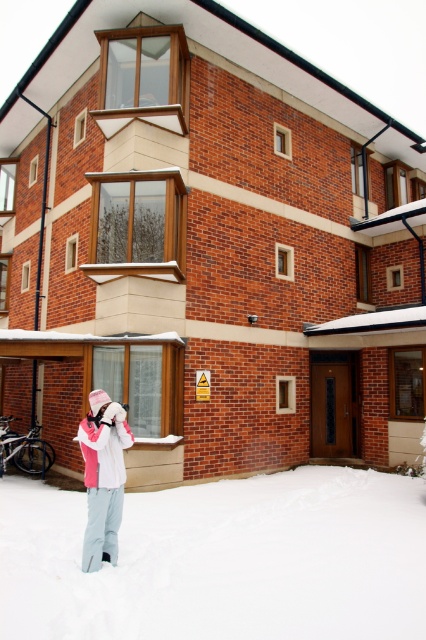
Does point (3, 625) lie in front of point (86, 470)?

Yes, it is in front of point (86, 470).

Who is positioned more to the left, white fluffy snow at lower center or white fleece jacket at lower left?

Positioned to the left is white fleece jacket at lower left.

Locate an element on the screen. The width and height of the screenshot is (426, 640). white fluffy snow at lower center is located at coordinates (221, 561).